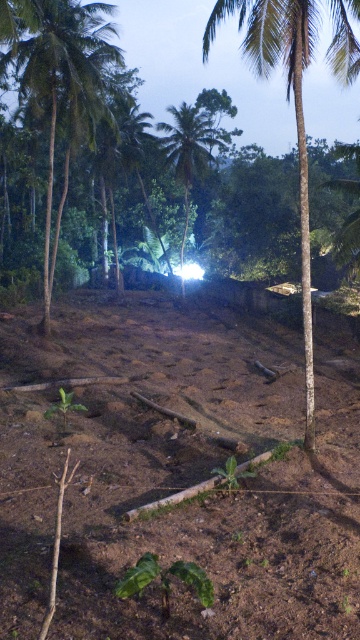
Question: Does green rough bark palm tree at center have a smaller size compared to green leafy palm tree at center?

Choices:
 (A) no
 (B) yes

Answer: (A)

Question: In this image, where is brown soil at center located relative to green leafy palm tree at left?

Choices:
 (A) above
 (B) below

Answer: (B)

Question: Which of the following is the closest to the observer?

Choices:
 (A) (257, 54)
 (B) (81, 65)

Answer: (A)

Question: Based on their relative distances, which object is farther from the green rough bark palm tree at center?

Choices:
 (A) brown soil at center
 (B) green leafy palm tree at left

Answer: (B)

Question: Can you confirm if brown soil at center is positioned to the left of green leafy palm tree at center?

Choices:
 (A) no
 (B) yes

Answer: (A)

Question: Which object appears closest to the camera in this image?

Choices:
 (A) brown soil at center
 (B) green leafy palm tree at center

Answer: (A)